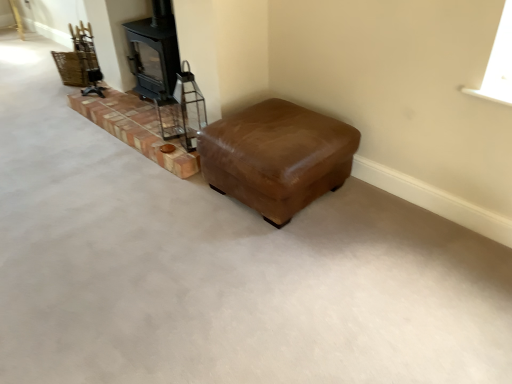
What is the approximate width of brick at left?

22.16 inches.

Where is `brown leather ottoman at center`? Image resolution: width=512 pixels, height=384 pixels. brown leather ottoman at center is located at coordinates [277, 157].

In the image, is black matte wood burning stove at upper left on the left side or the right side of brick at left?

From the image, it's evident that black matte wood burning stove at upper left is to the right of brick at left.

Considering the relative sizes of black matte wood burning stove at upper left and brick at left in the image provided, is black matte wood burning stove at upper left bigger than brick at left?

Yes.

Is point (167, 3) positioned after point (125, 131)?

No, (167, 3) is in front of (125, 131).

From a real-world perspective, is black matte wood burning stove at upper left beneath brick at left?

No, from a real-world perspective, black matte wood burning stove at upper left is not beneath brick at left.

Which object is closer to the camera, brown leather ottoman at center or black matte wood burning stove at upper left?

brown leather ottoman at center.

Does brown leather ottoman at center appear on the right side of black matte wood burning stove at upper left?

Yes, brown leather ottoman at center is to the right of black matte wood burning stove at upper left.

Where is `furniture to the right of black matte wood burning stove at upper left`? This screenshot has width=512, height=384. furniture to the right of black matte wood burning stove at upper left is located at coordinates (277, 157).

Which of these two, brown leather ottoman at center or black matte wood burning stove at upper left, is smaller?

black matte wood burning stove at upper left is smaller.

Is brown leather ottoman at center at the back of black matte wood burning stove at upper left?

No, black matte wood burning stove at upper left is not facing the opposite direction of brown leather ottoman at center.

Which object is positioned more to the right, black matte wood burning stove at upper left or brown leather ottoman at center?

Positioned to the right is brown leather ottoman at center.

From the image's perspective, is black matte wood burning stove at upper left under brown leather ottoman at center?

No, from the image's perspective, black matte wood burning stove at upper left is not below brown leather ottoman at center.

Is brick at left a part of brown leather ottoman at center?

No, brick at left is not inside brown leather ottoman at center.

Which is closer to the camera, (291, 196) or (123, 132)?

Point (291, 196) is positioned closer to the camera compared to point (123, 132).

Who is smaller, brown leather ottoman at center or brick at left?

brick at left is smaller.

Considering the relative positions of brown leather ottoman at center and brick at left in the image provided, is brown leather ottoman at center behind brick at left?

No, brown leather ottoman at center is closer to the viewer.

Based on the photo, from a real-world perspective, which is physically above, brick at left or brown leather ottoman at center?

From a 3D spatial view, brown leather ottoman at center is above.

From the image's perspective, is brick at left located above or below brown leather ottoman at center?

brick at left is situated higher than brown leather ottoman at center in the image.

From the image's perspective, between brick at left and black matte wood burning stove at upper left, which one is located above?

black matte wood burning stove at upper left appears higher in the image.

Is brick at left beside black matte wood burning stove at upper left?

No, brick at left is not next to black matte wood burning stove at upper left.

Which is correct: brick at left is inside black matte wood burning stove at upper left, or outside of it?

brick at left is not inside black matte wood burning stove at upper left, it's outside.

Which object is wider, brick at left or black matte wood burning stove at upper left?

brick at left.

The image size is (512, 384). In the image, there is a black matte wood burning stove at upper left. What are the coordinates of `stairwell below it (from a real-world perspective)` in the screenshot? It's located at (135, 128).

Where is `wood burning stove above the brown leather ottoman at center (from the image's perspective)`? The height and width of the screenshot is (384, 512). wood burning stove above the brown leather ottoman at center (from the image's perspective) is located at coordinates (154, 52).

From the image, which object appears to be nearer to black matte wood burning stove at upper left, brick at left or brown leather ottoman at center?

Result: brick at left.

Which object lies further to the anchor point brown leather ottoman at center, brick at left or black matte wood burning stove at upper left?

black matte wood burning stove at upper left lies further to brown leather ottoman at center than the other object.

Considering their positions, is brown leather ottoman at center positioned closer to brick at left than black matte wood burning stove at upper left?

black matte wood burning stove at upper left is closer to brick at left.

Considering their positions, is brown leather ottoman at center positioned further to black matte wood burning stove at upper left than brick at left?

Among the two, brown leather ottoman at center is located further to black matte wood burning stove at upper left.

Estimate the real-world distances between objects in this image. Which object is closer to brown leather ottoman at center, black matte wood burning stove at upper left or brick at left?

brick at left lies closer to brown leather ottoman at center than the other object.

Which object lies further to the anchor point brick at left, black matte wood burning stove at upper left or brown leather ottoman at center?

brown leather ottoman at center is positioned further to the anchor brick at left.

At what (x,y) coordinates should I click in order to perform the action: click on wood burning stove between brick at left and brown leather ottoman at center in the horizontal direction. Please return your answer as a coordinate pair (x, y). The image size is (512, 384). Looking at the image, I should click on (154, 52).